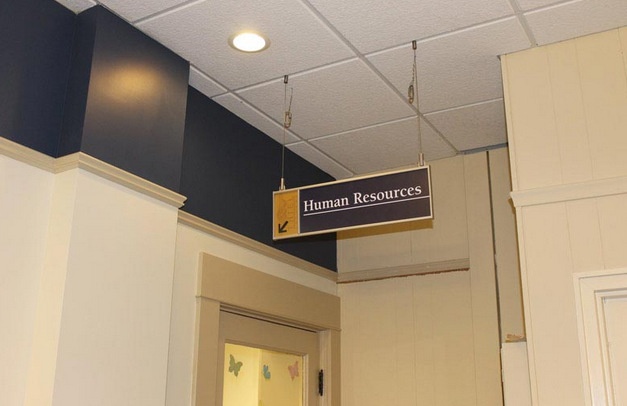
Locate an element on the screen. Image resolution: width=627 pixels, height=406 pixels. light reflection on dark wall is located at coordinates (132, 85).